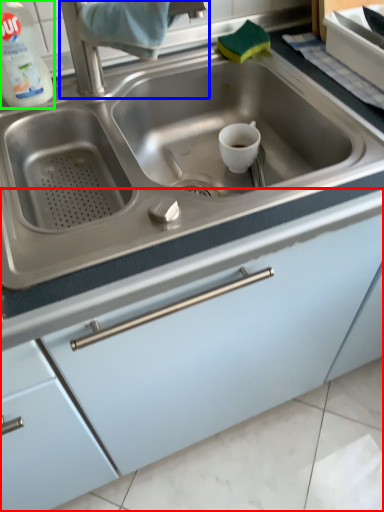
Question: Considering the real-world distances, which object is farthest from cabinetry (highlighted by a red box)? faucet (highlighted by a blue box) or cleaning product (highlighted by a green box)?

Choices:
 (A) faucet
 (B) cleaning product

Answer: (B)